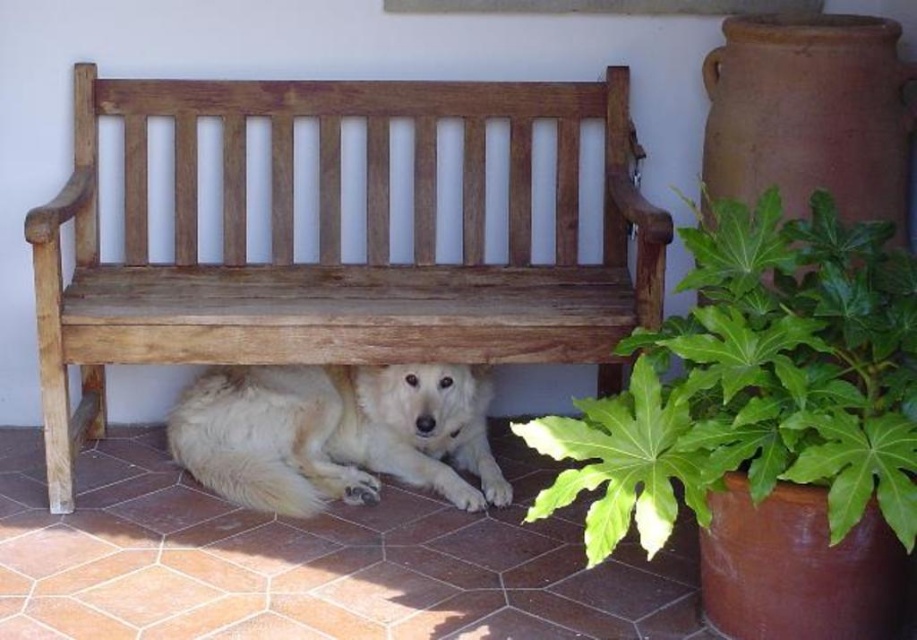
Question: Which of the following is the closest to the observer?

Choices:
 (A) (x=860, y=332)
 (B) (x=191, y=285)
 (C) (x=279, y=388)

Answer: (A)

Question: Is the position of wooden bench at center more distant than that of white fluffy dog at under bench?

Choices:
 (A) no
 (B) yes

Answer: (A)

Question: Among these objects, which one is nearest to the camera?

Choices:
 (A) white fluffy dog at under bench
 (B) green leafy plant at lower right

Answer: (B)

Question: Based on their relative distances, which object is nearer to the wooden bench at center?

Choices:
 (A) white fluffy dog at under bench
 (B) green leafy plant at lower right

Answer: (A)

Question: Is wooden bench at center below green leafy plant at lower right?

Choices:
 (A) yes
 (B) no

Answer: (B)

Question: Is wooden bench at center bigger than white fluffy dog at under bench?

Choices:
 (A) no
 (B) yes

Answer: (B)